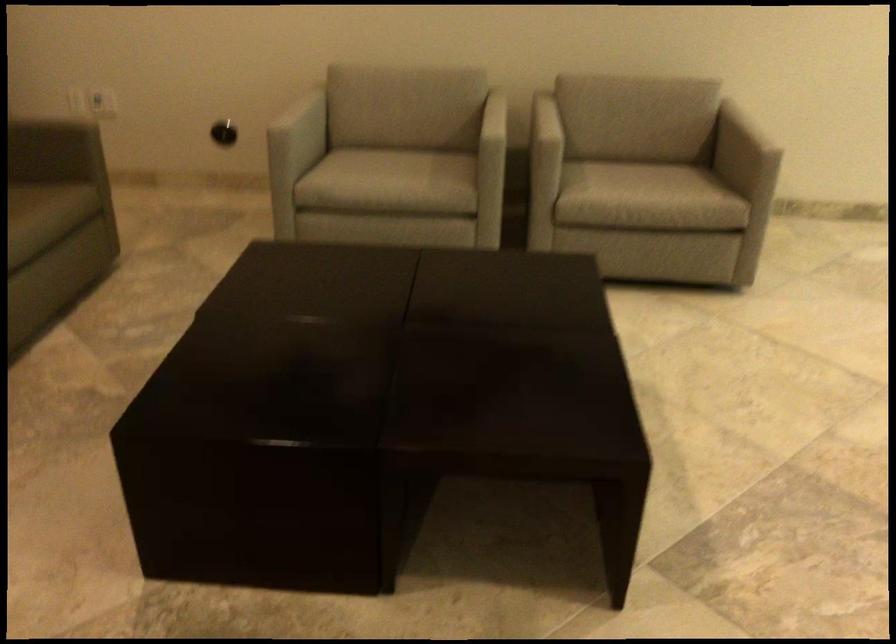
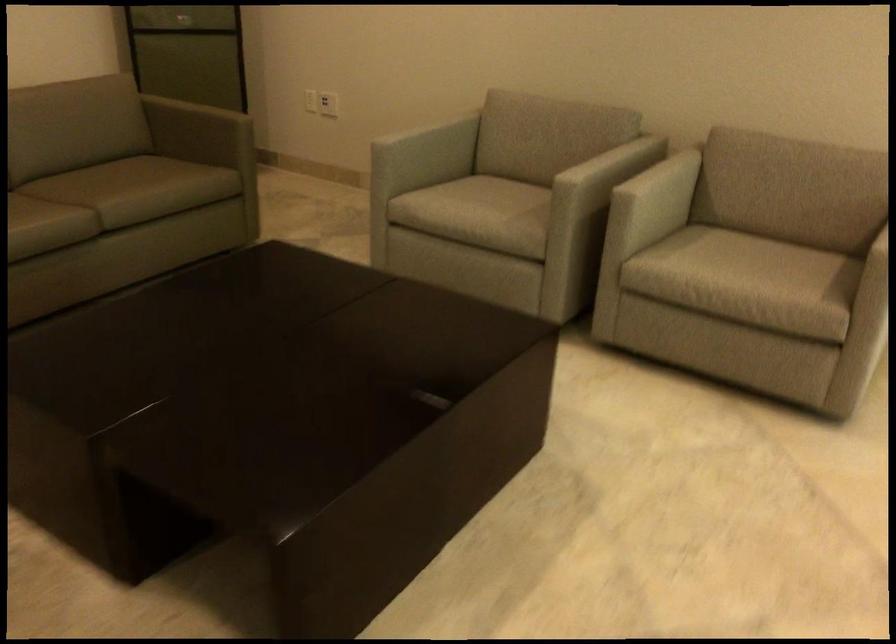
Locate, in the second image, the point that corresponds to [623,173] in the first image.

(739, 257)